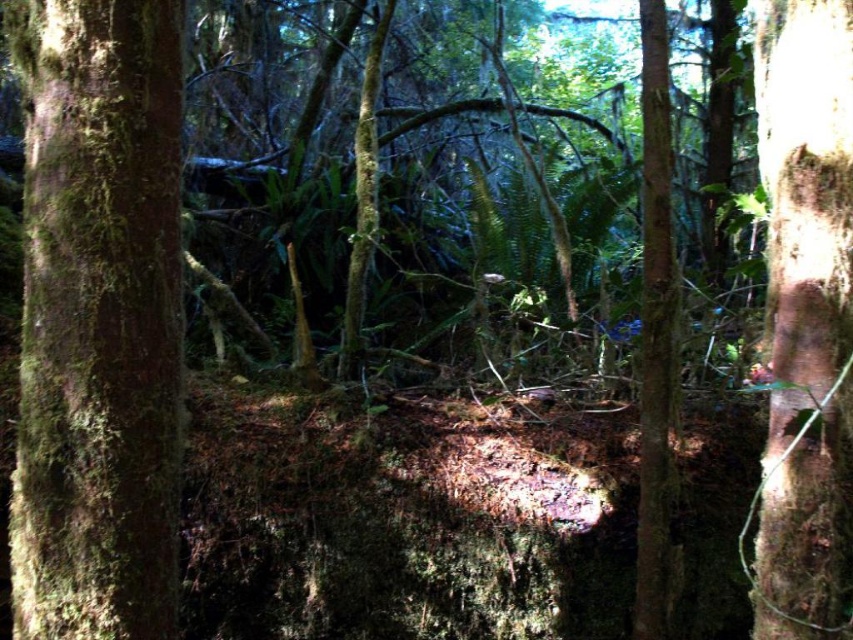
Question: Is green mossy tree trunk at left to the left of smooth bark tree trunk at center from the viewer's perspective?

Choices:
 (A) no
 (B) yes

Answer: (B)

Question: Does green mossy tree trunk at left have a lesser width compared to smooth bark tree trunk at center?

Choices:
 (A) yes
 (B) no

Answer: (B)

Question: Can you confirm if green mossy tree trunk at left is bigger than smooth bark tree trunk at center?

Choices:
 (A) yes
 (B) no

Answer: (B)

Question: Which of the following is the closest to the observer?

Choices:
 (A) brown rough bark tree trunk at right
 (B) green mossy tree trunk at left

Answer: (A)

Question: Which point appears farthest from the camera in this image?

Choices:
 (A) (646, 138)
 (B) (97, 116)
 (C) (792, 337)

Answer: (A)

Question: Which point is closer to the camera?

Choices:
 (A) brown rough bark tree trunk at right
 (B) smooth bark tree trunk at center

Answer: (A)